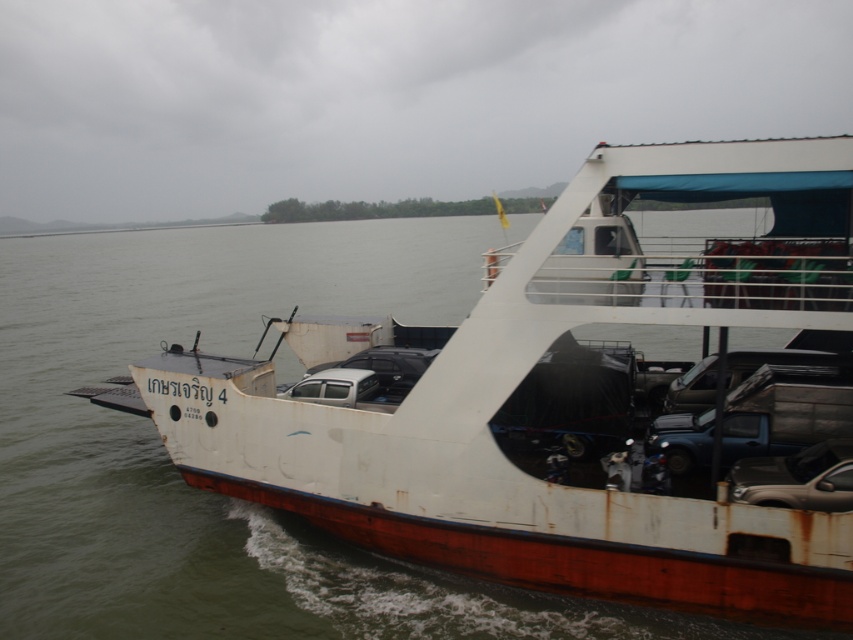
You are a passenger on the ferry and want to take a photo of the shiny silver car at lower right without including the white matte boat at center in the frame. Is this possible given their positions?

The white matte boat at center is located above the shiny silver car at lower right, so it would block the view. Therefore, it is not possible to take a photo of the shiny silver car at lower right without including the white matte boat at center in the frame.

You are a passenger on the ferry boat and want to take a photo of the white matte boat at center and the shiny silver car at lower right. Which object should you place on the left side of your photo frame to capture both correctly?

To capture both the white matte boat at center and the shiny silver car at lower right correctly, you should place the white matte boat at center on the left side of your photo frame since it is positioned on the left side of the shiny silver car at lower right.